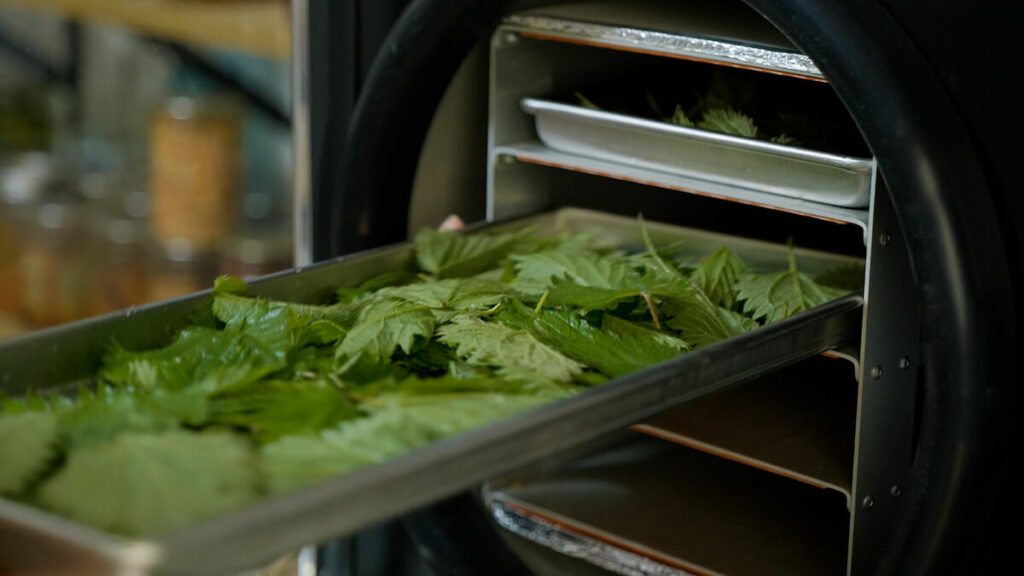
This screenshot has width=1024, height=576. Find the location of `screws`. screws is located at coordinates (878, 375), (916, 367), (894, 490), (863, 501), (873, 241).